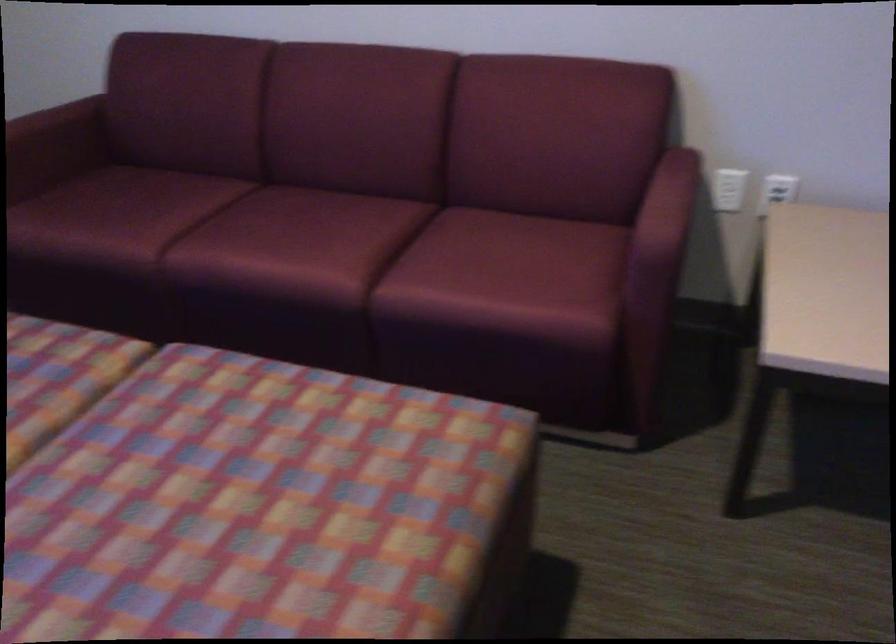
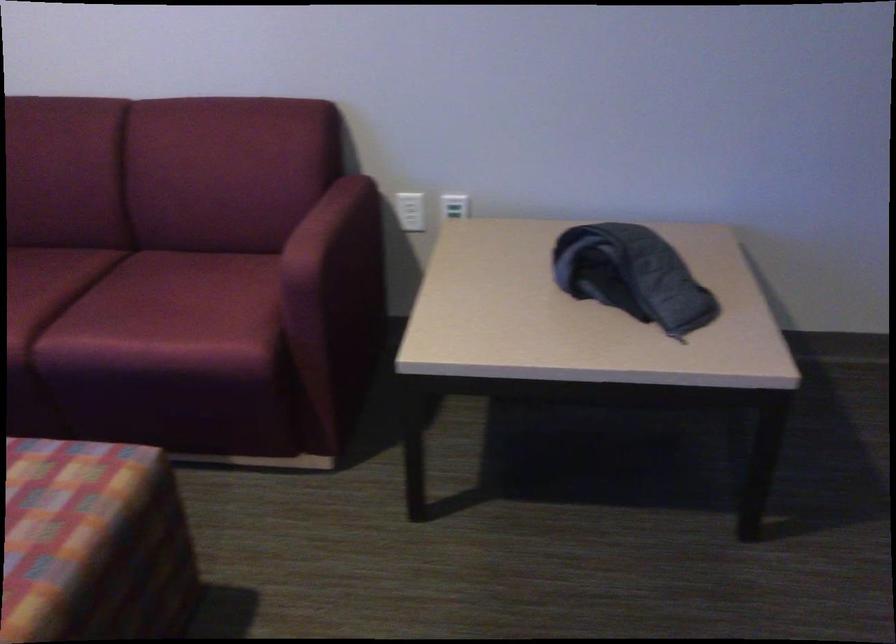
Locate, in the second image, the point that corresponds to point 501,252 in the first image.

(175, 290)